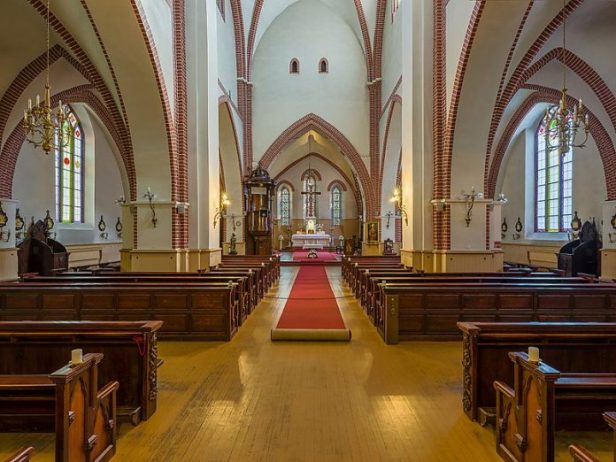
Locate an element on the screen. This screenshot has width=616, height=462. arm rest is located at coordinates pos(506,389).